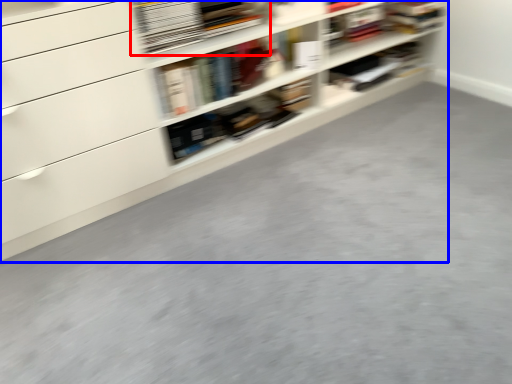
Question: Among these objects, which one is farthest to the camera, book (highlighted by a red box) or shelf (highlighted by a blue box)?

Choices:
 (A) book
 (B) shelf

Answer: (A)